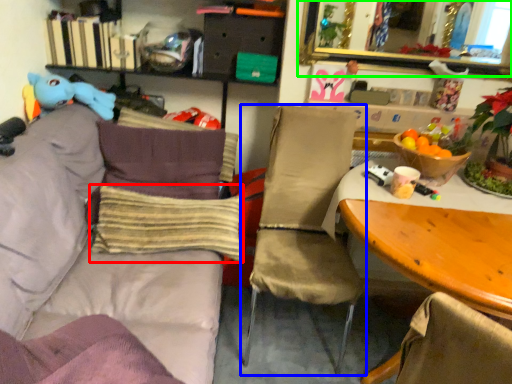
Question: Which is nearer to the pillow (highlighted by a red box)? chair (highlighted by a blue box) or mirror (highlighted by a green box).

Choices:
 (A) chair
 (B) mirror

Answer: (A)